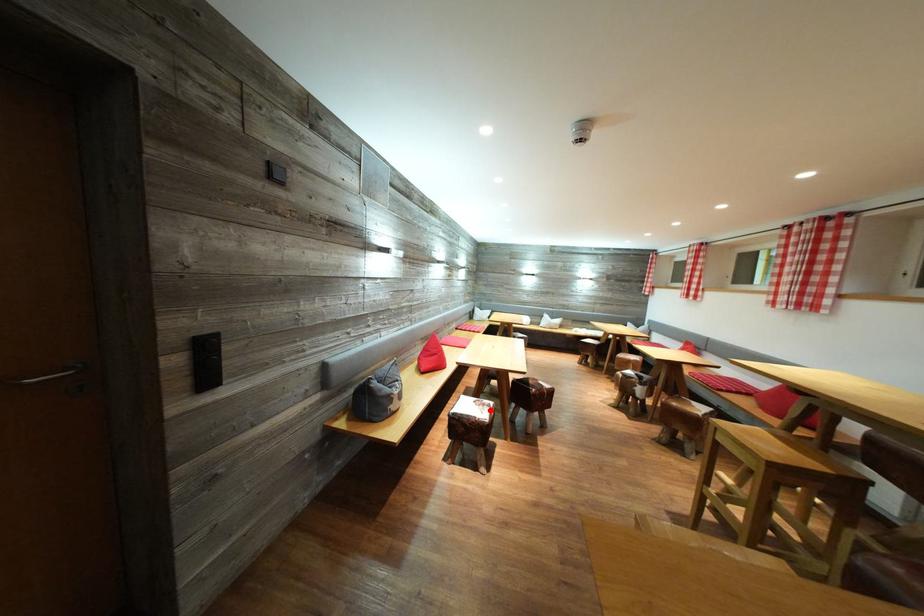
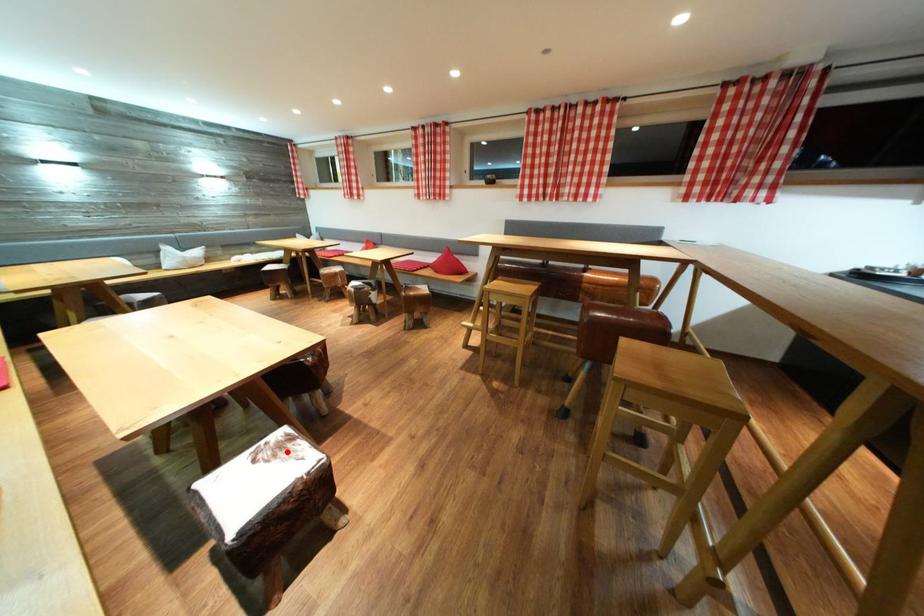
I am providing you with two images of the same scene from different viewpoints. A red point is marked on the first image and another point is marked on the second image. Does the point marked in image1 correspond to the same location as the one in image2?

Yes